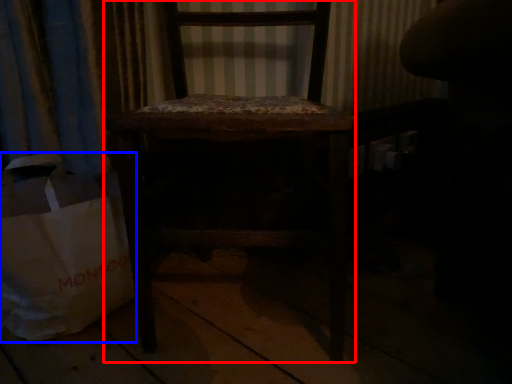
Question: Which object appears closest to the camera in this image, chair (highlighted by a red box) or grocery bag (highlighted by a blue box)?

Choices:
 (A) chair
 (B) grocery bag

Answer: (A)